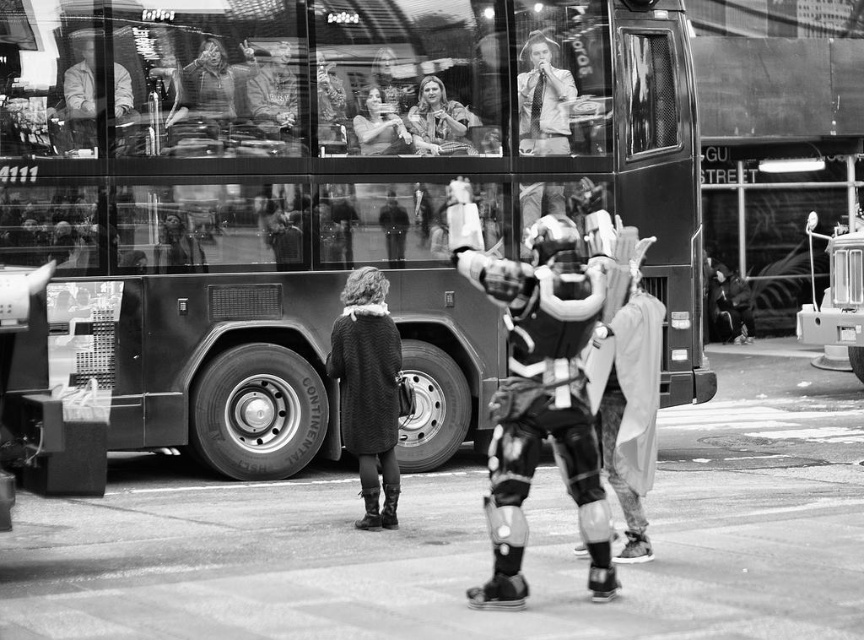
Which is behind, point (329, 228) or point (469, 260)?

The point (329, 228) is behind.

In the scene shown: Is metallic bus at center below metallic armor suit at center?

No, metallic bus at center is not below metallic armor suit at center.

Is point (86, 26) farther from camera compared to point (456, 225)?

Yes.

I want to click on metallic bus at center, so click(337, 202).

Is metallic armor suit at center further to camera compared to matte black jacket at upper left?

No, it is not.

Between metallic armor suit at center and matte black jacket at upper left, which one appears on the right side from the viewer's perspective?

From the viewer's perspective, metallic armor suit at center appears more on the right side.

Who is more distant from viewer, (x=545, y=356) or (x=75, y=131)?

Positioned behind is point (x=75, y=131).

Identify the location of metallic armor suit at center. (540, 392).

Does metallic bus at center have a lesser width compared to knitted wool coat at center?

Yes.

Between metallic bus at center and knitted wool coat at center, which one is positioned higher?

Positioned higher is metallic bus at center.

I want to click on metallic bus at center, so click(337, 202).